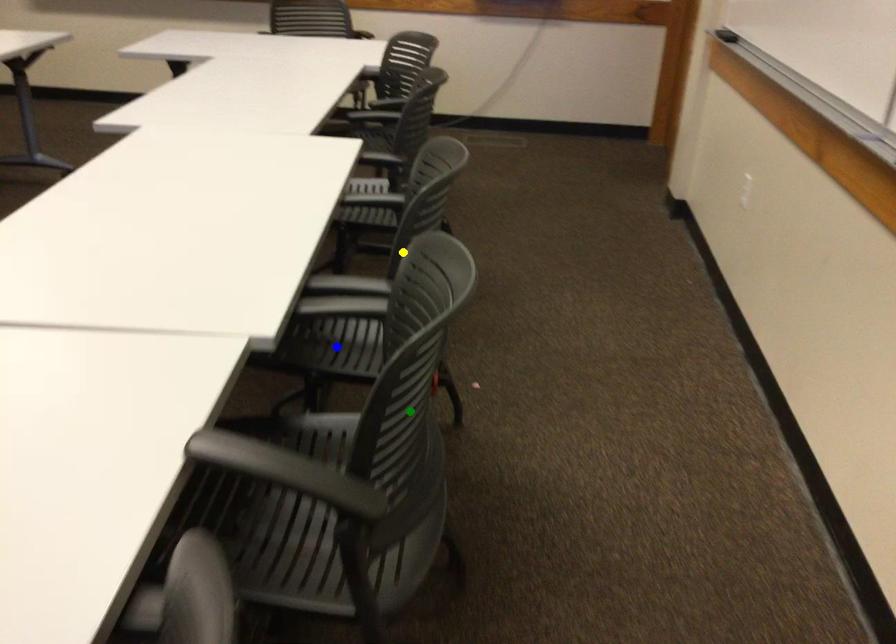
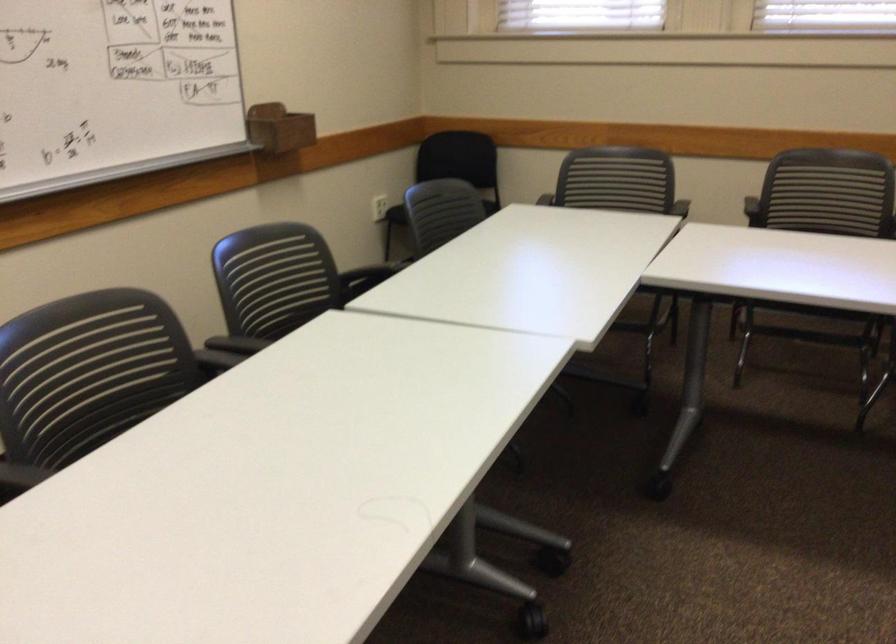
I am providing you with two images of the same scene from different viewpoints. Three points are marked in image1. Which point corresponds to a part or object that is occluded in image2?In image1, three points are marked. Which of them correspond to a part or object that is occluded in image2?Among the three points shown in image1, which one corresponds to a part or object that is no longer visible due to occlusion in image2?

Invisible in image2: blue point.